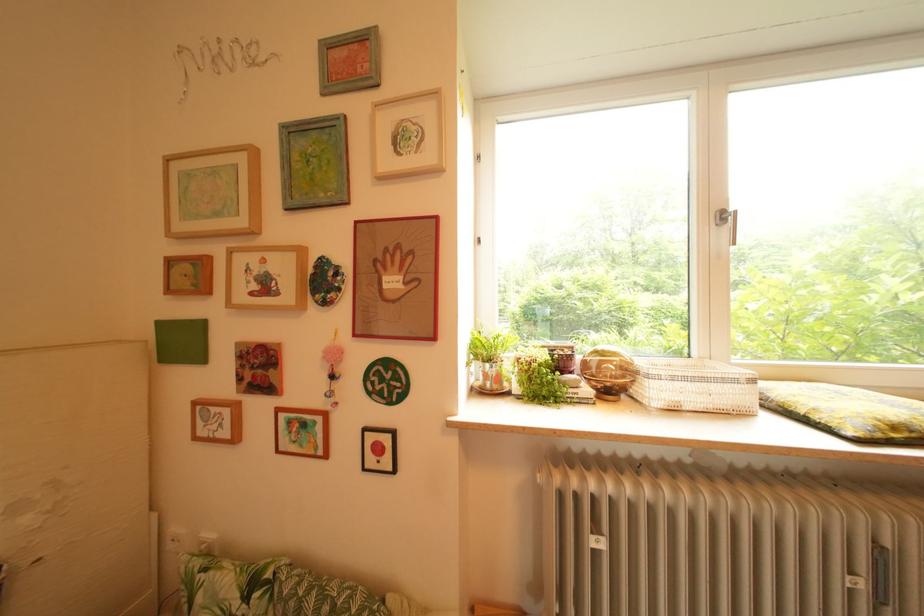
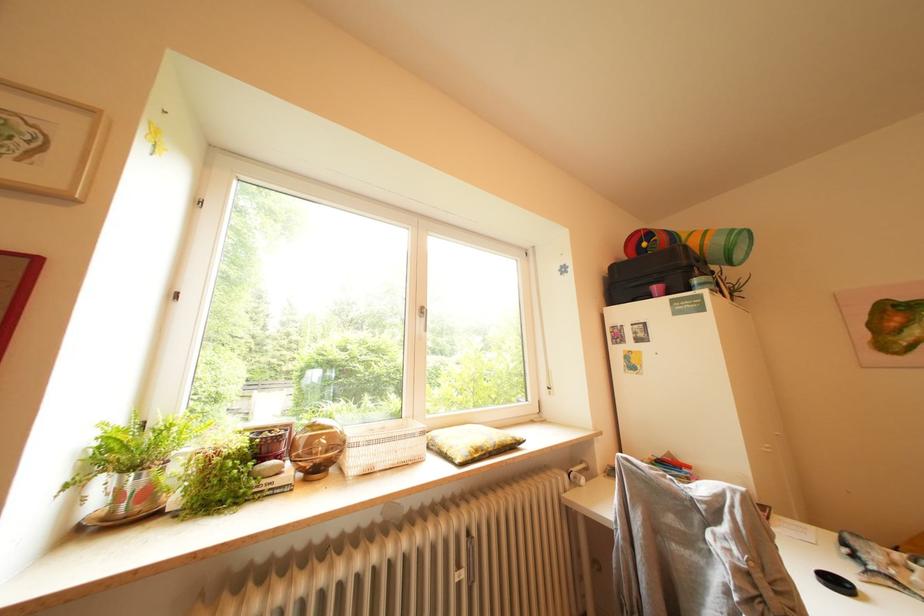
Question: The first image is from the beginning of the video and the second image is from the end. How did the camera likely rotate when shooting the video?

Choices:
 (A) Left
 (B) Right
 (C) Up
 (D) Down

Answer: (B)